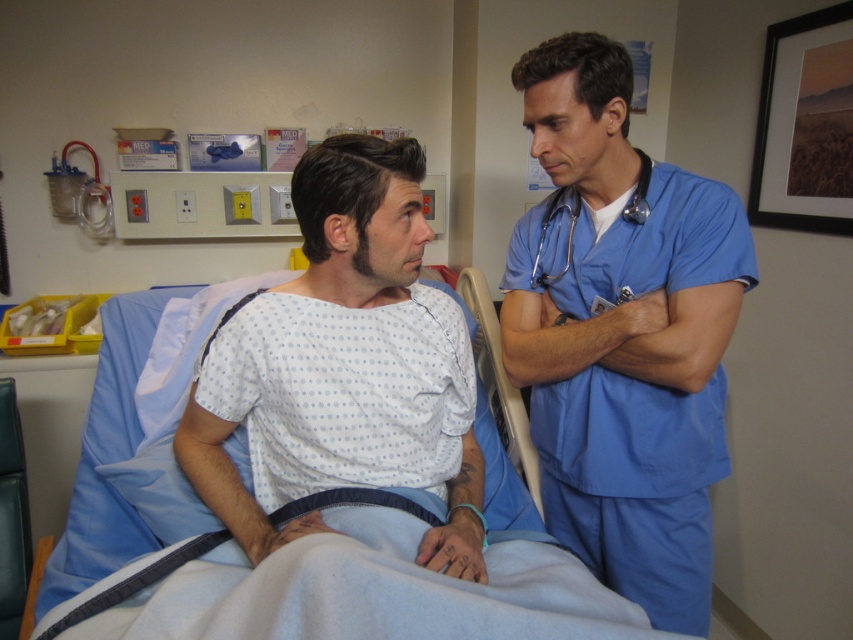
You are a patient in a hospital room and need to locate your doctor. You see the blue scrubs at right and the metallic blue stethoscope at upper right. Which object is positioned higher in the image?

The metallic blue stethoscope at upper right is positioned higher than the blue scrubs at right in the image.

You are a patient in a hospital room and want to reach the blue scrubs at right without stepping on the blue fabric hospital bed at center. Is this possible?

The blue scrubs at right is to the right of the blue fabric hospital bed at center, so you can walk around the bed to the right side to reach the blue scrubs at right without stepping on the bed.

You are a hospital maintenance worker checking the height of objects in the room. You see the blue scrubs at right and the blue fabric hospital bed at center. Which object is taller?

The blue scrubs at right is taller than blue fabric hospital bed at center.